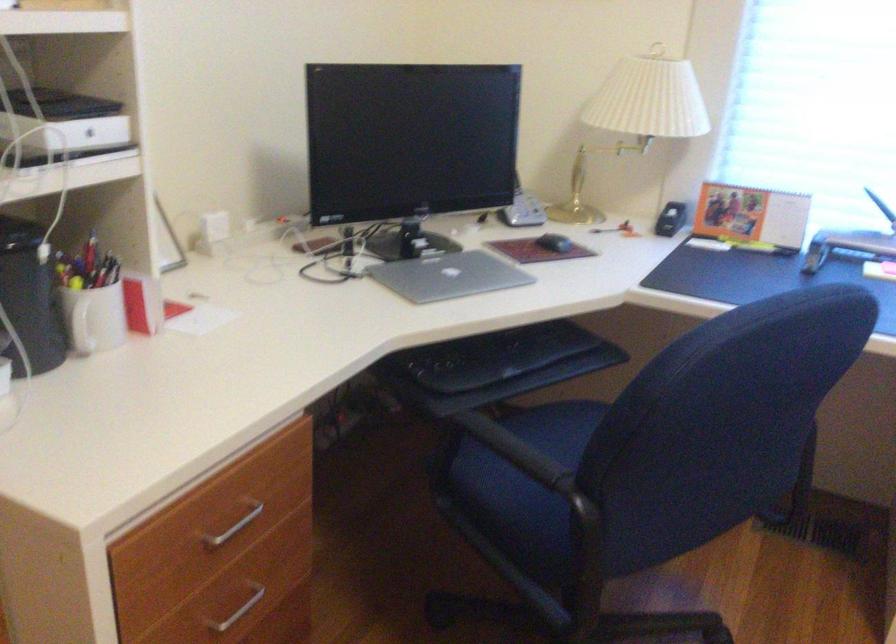
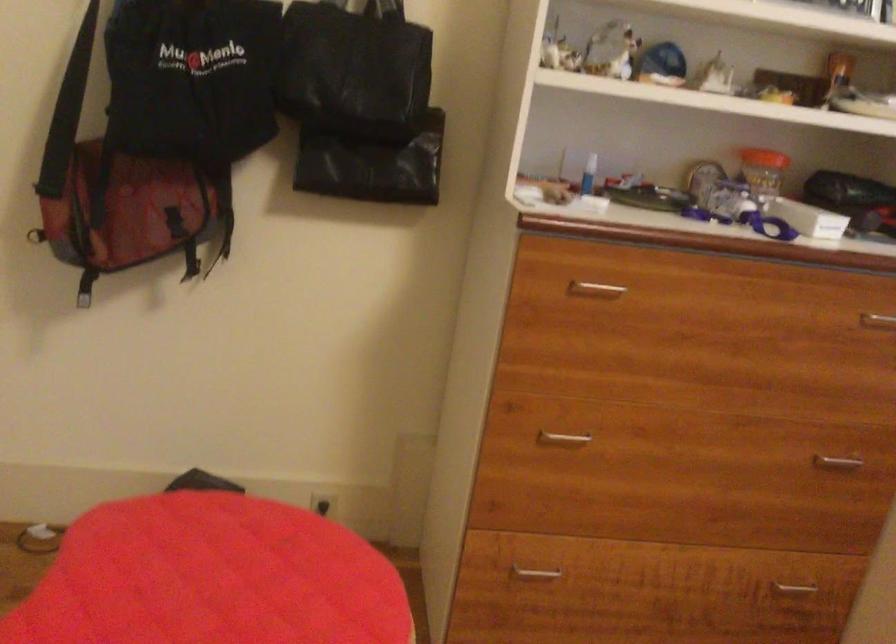
Question: The camera is either moving clockwise (left) or counter-clockwise (right) around the object. The first image is from the beginning of the video and the second image is from the end. Is the camera moving left or right when shooting the video?

Choices:
 (A) Left
 (B) Right

Answer: (B)